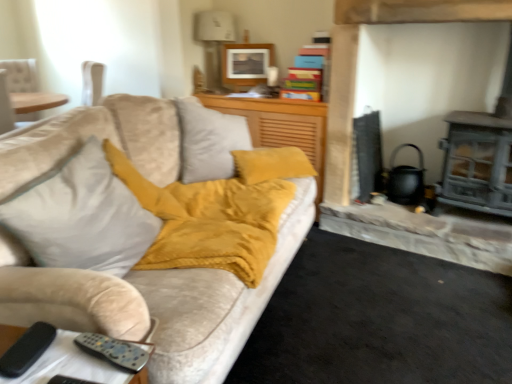
Question: Is suede-like mustard yellow cushion at center wider than matte gray fireplace at right?

Choices:
 (A) yes
 (B) no

Answer: (A)

Question: Is suede-like mustard yellow cushion at center further to the viewer compared to matte gray fireplace at right?

Choices:
 (A) yes
 (B) no

Answer: (A)

Question: From a real-world perspective, is suede-like mustard yellow cushion at center beneath matte gray fireplace at right?

Choices:
 (A) yes
 (B) no

Answer: (A)

Question: Can you confirm if suede-like mustard yellow cushion at center is smaller than matte gray fireplace at right?

Choices:
 (A) yes
 (B) no

Answer: (A)

Question: Is matte gray fireplace at right located within suede-like mustard yellow cushion at center?

Choices:
 (A) no
 (B) yes

Answer: (A)

Question: From the image's perspective, is matte wooden picture frame at upper center positioned above or below velvet yellow throw pillow at center?

Choices:
 (A) above
 (B) below

Answer: (A)

Question: Is matte wooden picture frame at upper center inside or outside of velvet yellow throw pillow at center?

Choices:
 (A) inside
 (B) outside

Answer: (B)

Question: Is matte wooden picture frame at upper center to the left or to the right of velvet yellow throw pillow at center in the image?

Choices:
 (A) right
 (B) left

Answer: (A)

Question: Is point (241, 76) closer or farther from the camera than point (92, 261)?

Choices:
 (A) closer
 (B) farther

Answer: (B)

Question: From the image's perspective, is matte gray fireplace at right located above or below metallic silver remote control at lower left?

Choices:
 (A) above
 (B) below

Answer: (A)

Question: Would you say matte gray fireplace at right is inside or outside metallic silver remote control at lower left?

Choices:
 (A) outside
 (B) inside

Answer: (A)

Question: Does point (347, 196) appear closer or farther from the camera than point (45, 362)?

Choices:
 (A) farther
 (B) closer

Answer: (A)

Question: Considering their positions, is matte gray fireplace at right located in front of or behind metallic silver remote control at lower left?

Choices:
 (A) front
 (B) behind

Answer: (B)

Question: From a real-world perspective, is matte gray fireplace at right physically located above or below matte wooden picture frame at upper center?

Choices:
 (A) below
 (B) above

Answer: (A)

Question: In the image, is matte gray fireplace at right positioned in front of or behind matte wooden picture frame at upper center?

Choices:
 (A) behind
 (B) front

Answer: (B)